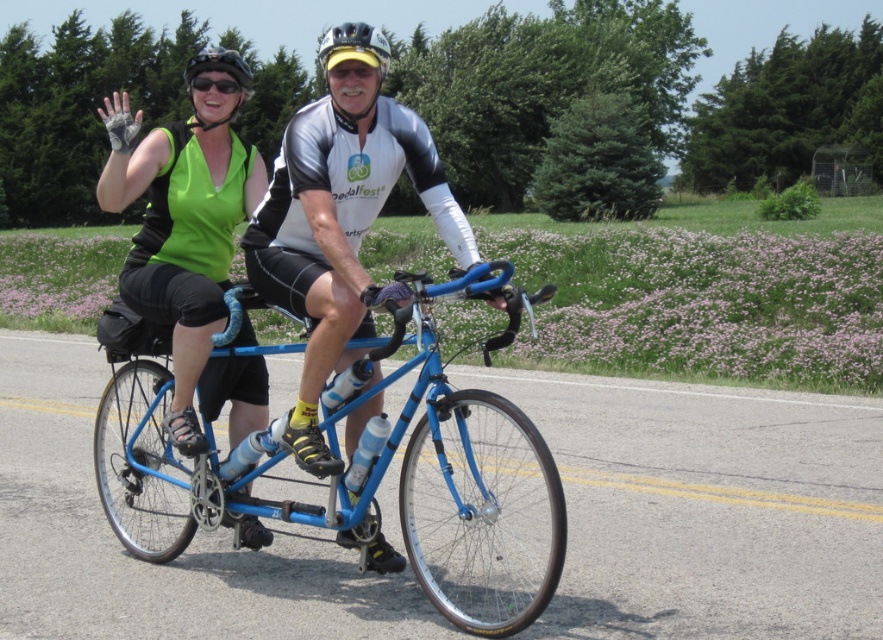
Question: Is blue metallic bicycle at center positioned in front of green matte tank top at left?

Choices:
 (A) no
 (B) yes

Answer: (B)

Question: Among these objects, which one is farthest from the camera?

Choices:
 (A) green matte tank top at left
 (B) matte blue tandem bicycle at center
 (C) black rubber goggles at upper center

Answer: (C)

Question: Is green matte tank top at left smaller than white matte helmet at center?

Choices:
 (A) yes
 (B) no

Answer: (A)

Question: Among these points, which one is farthest from the camera?

Choices:
 (A) (242, 83)
 (B) (231, 81)
 (C) (352, 45)

Answer: (A)

Question: Is blue metallic bicycle at center to the left of matte blue tandem bicycle at center from the viewer's perspective?

Choices:
 (A) no
 (B) yes

Answer: (A)

Question: Which of the following is the closest to the observer?

Choices:
 (A) (238, 64)
 (B) (131, 288)

Answer: (B)